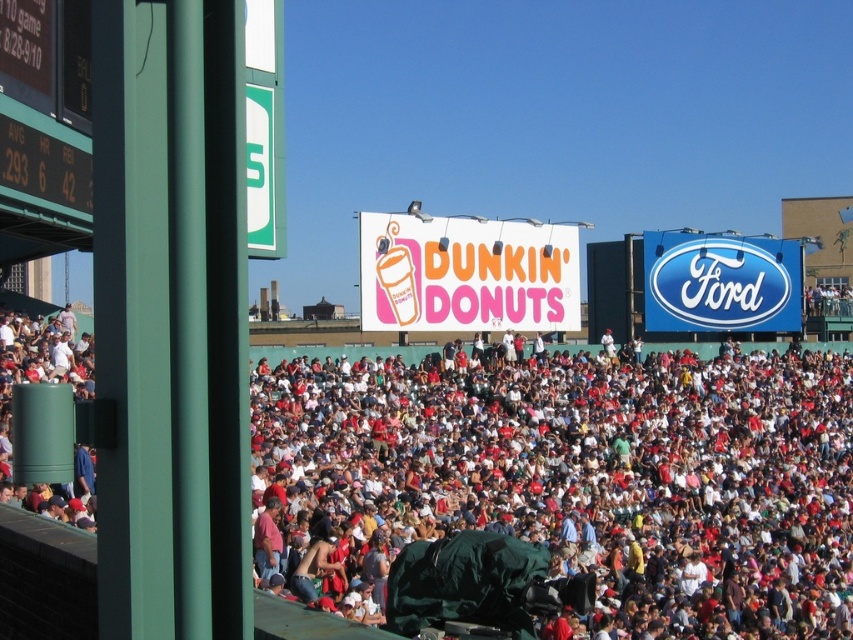
You are a photographer standing at the back of the stadium and want to take a photo of the green digital scoreboard at left. However, the white cotton crowd at center is blocking your view. Can you estimate if the crowd is taller than the scoreboard?

The white cotton crowd at center is taller than the green digital scoreboard at left, so the crowd will block the view of the scoreboard.

You are a photographer at the baseball stadium. You want to capture a photo that includes both the white cotton crowd at center and the green digital scoreboard at left. Which object should you zoom in on to ensure both are clearly visible in the frame?

To ensure both the white cotton crowd at center and the green digital scoreboard at left are clearly visible, you should zoom in on the green digital scoreboard at left since it is smaller than the crowd.

You are a drone operator trying to capture aerial footage of the baseball stadium. Your drone can only fly up to 20 meters. If you are positioned at the white cotton crowd at center, can you fly your drone to the green digital scoreboard at left without exceeding its maximum flight distance?

The distance between the white cotton crowd at center and the green digital digital scoreboard at left is 23.23 meters, which exceeds the drone maximum flight distance of 20 meters. Therefore, the drone cannot reach the green digital scoreboard at left from the white cotton crowd at center.